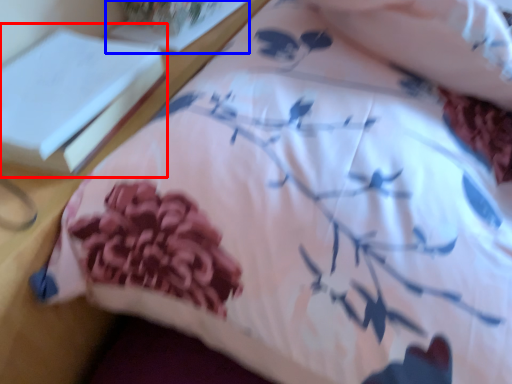
Question: Which object appears farthest to the camera in this image, book (highlighted by a red box) or book (highlighted by a blue box)?

Choices:
 (A) book
 (B) book

Answer: (B)